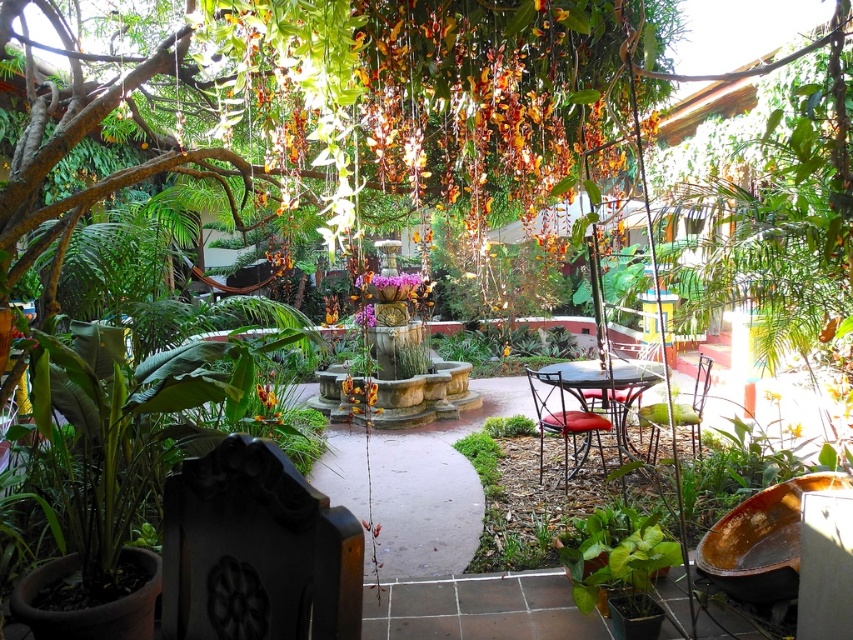
You are planning to place a small potted plant between the metallic red cushioned chair at center and the metallic red chair at center. Given that the potted plant requires a minimum of 15 inches of space to thrive, will there be enough space between them?

The distance between the metallic red cushioned chair at center and the metallic red chair at center is 12.79 inches, which is less than the required 15 inches. Therefore, there isn not enough space to place the potted plant between them.

You are planning to place a small decorative statue that is 20 cm wide on the garden patio. Given the space occupied by the green matte leaf at lower right and the metallic red cushioned chair at center, which object would allow more space around it for the statue?

The metallic red cushioned chair at center allows more space around it for the statue since the green matte leaf at lower right is narrower than the chair.

You are planning to place a new potted plant between the metallic brown table at center and the metallic red chair at center. Based on their positions, which object should the plant be closer to?

The metallic brown table at center is to the left of the metallic red chair at center, so the plant should be placed closer to the metallic red chair at center to maintain symmetry between the two objects.